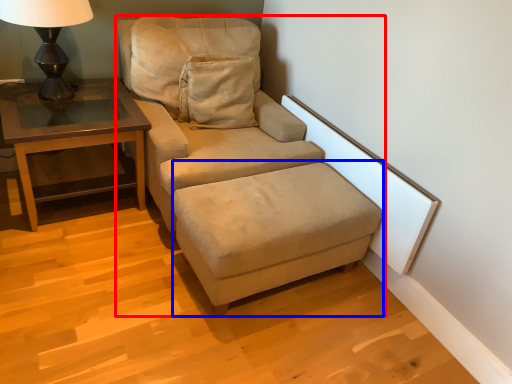
Question: Which point is further to the camera, studio couch (highlighted by a red box) or footrest (highlighted by a blue box)?

Choices:
 (A) studio couch
 (B) footrest

Answer: (A)